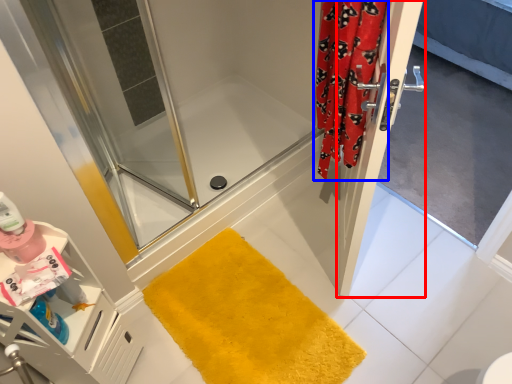
Question: Which object is further to the camera taking this photo, door (highlighted by a red box) or shower curtain (highlighted by a blue box)?

Choices:
 (A) door
 (B) shower curtain

Answer: (B)